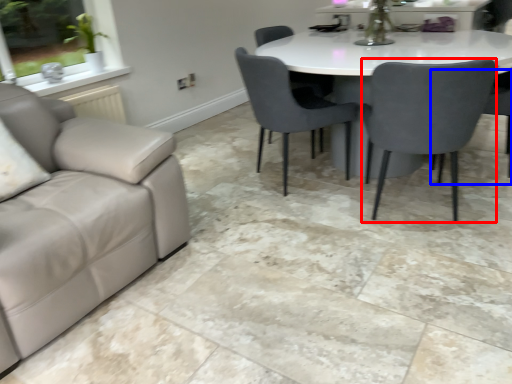
Question: Which object is further to the camera taking this photo, chair (highlighted by a red box) or chair (highlighted by a blue box)?

Choices:
 (A) chair
 (B) chair

Answer: (B)